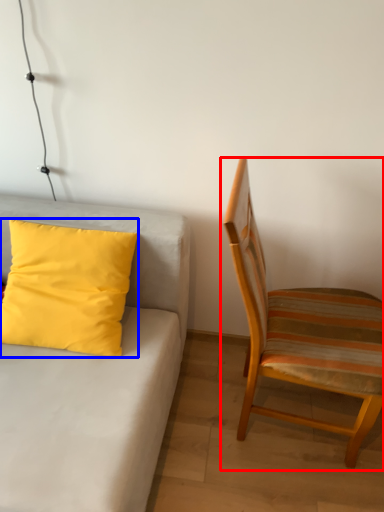
Question: Which point is further to the camera, chair (highlighted by a red box) or pillow (highlighted by a blue box)?

Choices:
 (A) chair
 (B) pillow

Answer: (B)